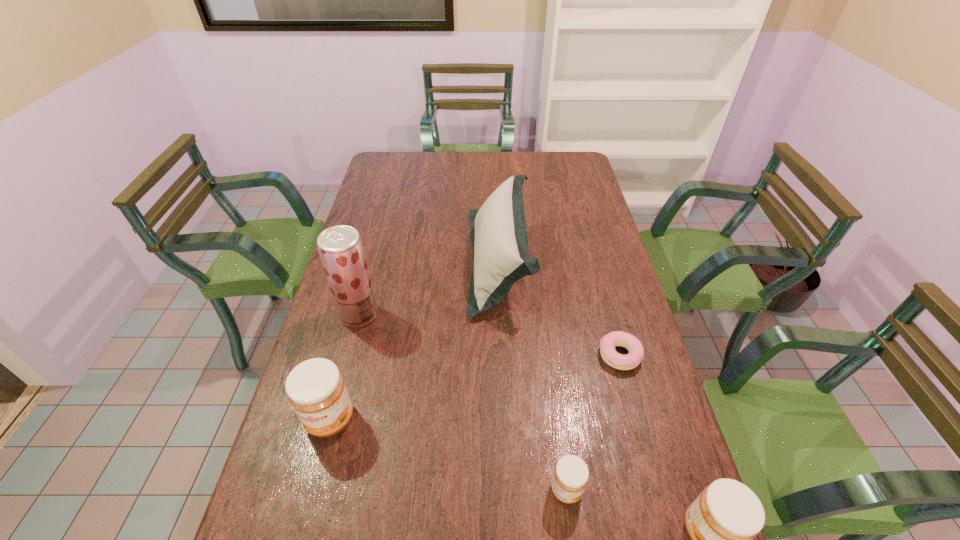
If equal spacing is the goal by inserting an additional jam among them, please point out a vacant space for this new jam. Please provide its 2D coordinates. Your answer should be formatted as a tuple, i.e. [(x, y)], where the tuple contains the x and y coordinates of a point satisfying the conditions above.

[(442, 452)]